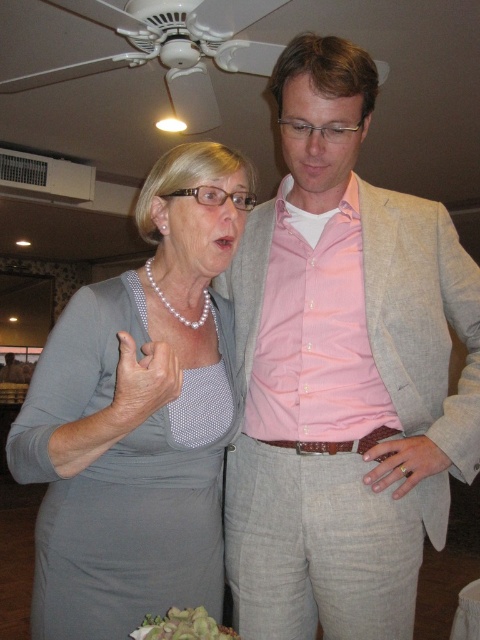
Which is behind, point (49, 630) or point (211, 621)?

The point (49, 630) is more distant.

How far apart are pearl necklace at center and green leafy salad at lower center?

pearl necklace at center is 14.01 inches from green leafy salad at lower center.

Locate an element on the screen. Image resolution: width=480 pixels, height=640 pixels. pearl necklace at center is located at coordinates (137, 416).

The height and width of the screenshot is (640, 480). Identify the location of pink linen suit at center. (343, 372).

Which is in front, point (226, 284) or point (163, 634)?

Point (163, 634)

Who is more distant from viewer, (x=446, y=252) or (x=204, y=636)?

Positioned behind is point (x=446, y=252).

Image resolution: width=480 pixels, height=640 pixels. In order to click on pink linen suit at center in this screenshot , I will do `click(343, 372)`.

Which is more to the left, pink linen suit at center or pearl necklace at center?

pearl necklace at center is more to the left.

Between point (314, 176) and point (132, 458), which one is positioned behind?

The point (314, 176) is more distant.

At what (x,y) coordinates should I click in order to perform the action: click on pink linen suit at center. Please return your answer as a coordinate pair (x, y). Image resolution: width=480 pixels, height=640 pixels. Looking at the image, I should click on (343, 372).